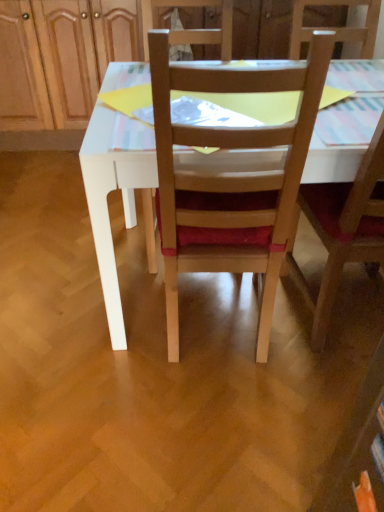
Question: Is wooden chair at center, acting as the first chair starting from the left, inside the boundaries of wooden chair at center, positioned as the 1th chair in right-to-left order, or outside?

Choices:
 (A) outside
 (B) inside

Answer: (A)

Question: Is wooden chair at center, the 2th chair viewed from the right, in front of or behind wooden chair at center, the 2th chair from the left, in the image?

Choices:
 (A) front
 (B) behind

Answer: (A)

Question: Considering the real-world distances, which object is farthest from the wooden dresser at upper center?

Choices:
 (A) wooden chair at center, positioned as the 1th chair in right-to-left order
 (B) wooden chair at center, acting as the first chair starting from the left

Answer: (A)

Question: Which object is positioned closest to the wooden chair at center, acting as the first chair starting from the left?

Choices:
 (A) wooden chair at center, the 2th chair from the left
 (B) wooden dresser at upper center

Answer: (A)